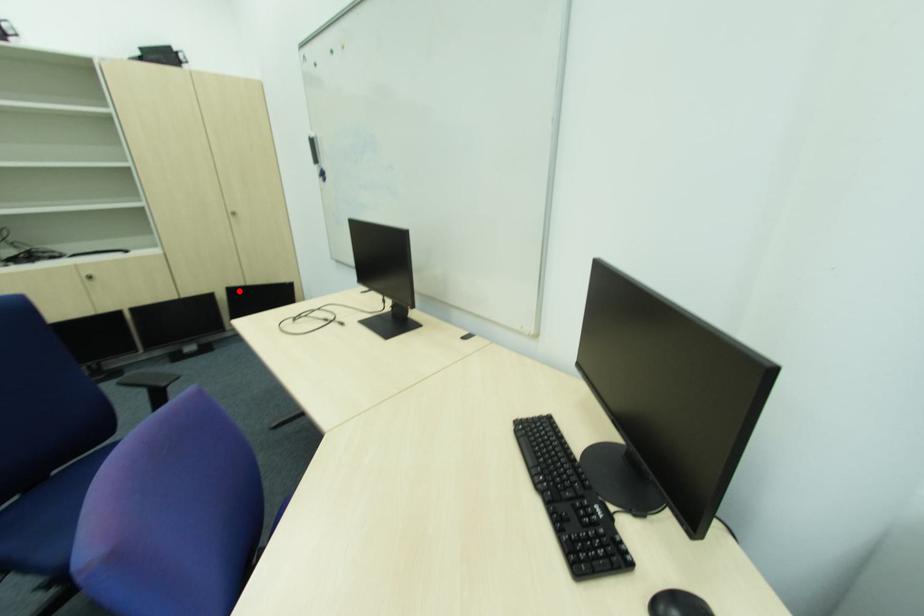
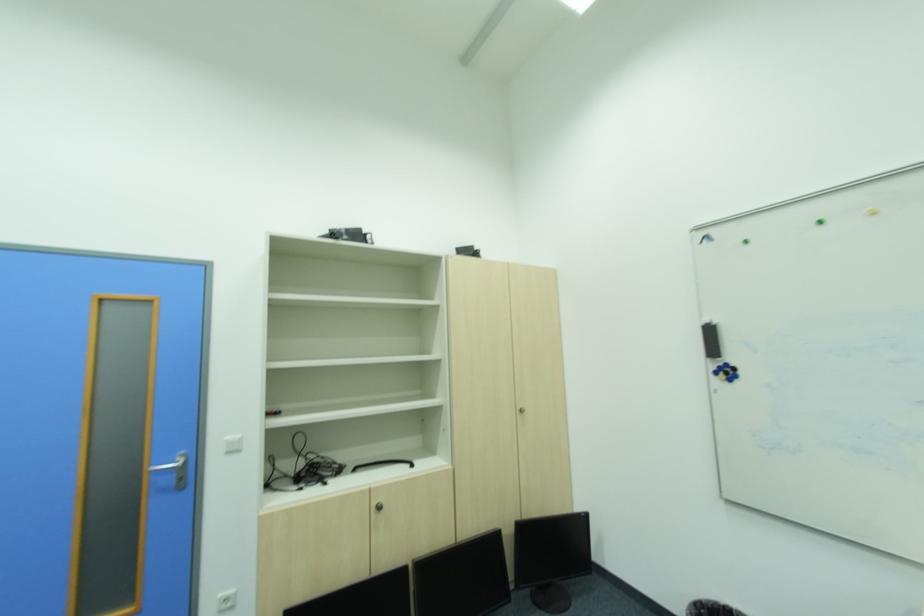
Locate, in the second image, the point that corresponds to the highlighted location in the first image.

(531, 531)